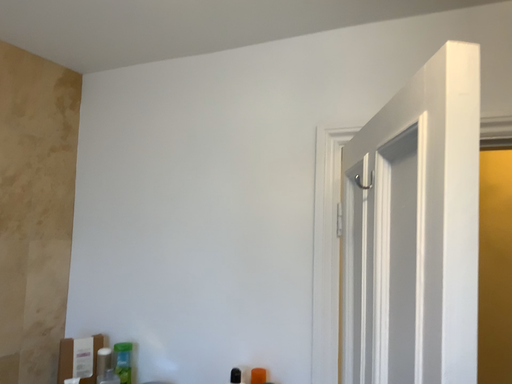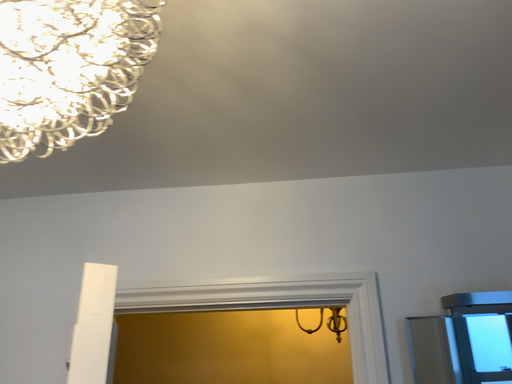
Question: How did the camera likely rotate when shooting the video?

Choices:
 (A) rotated downward
 (B) rotated upward

Answer: (B)